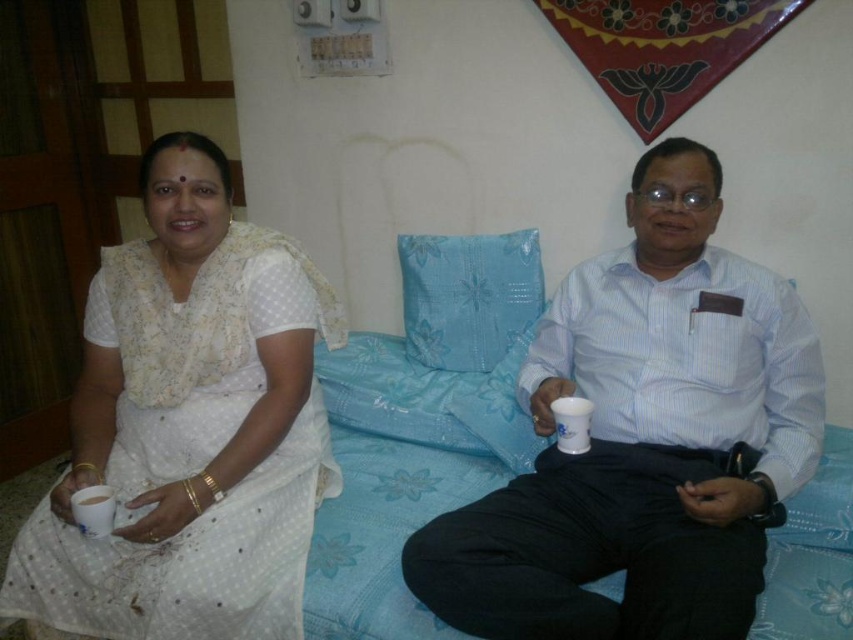
You are a delivery robot with a package that needs to be placed between the white dotted fabric at left and the white matte cup at lower left. The package is 14 inches long. Can the package fit in the space between them?

The white dotted fabric at left is 13.55 inches away from the white matte cup at lower left. Since the package is 14 inches long, it cannot fit in the space between them as the distance is slightly shorter than the package length.